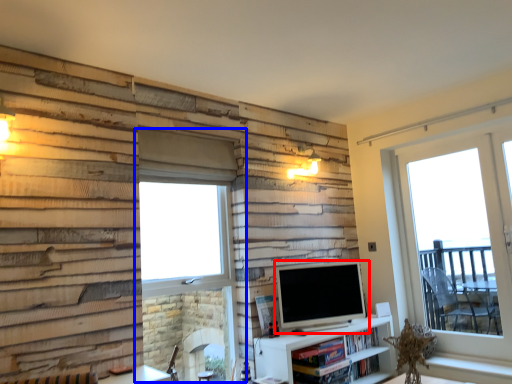
Question: Which of the following is the closest to the observer, television (highlighted by a red box) or window (highlighted by a blue box)?

Choices:
 (A) television
 (B) window

Answer: (B)